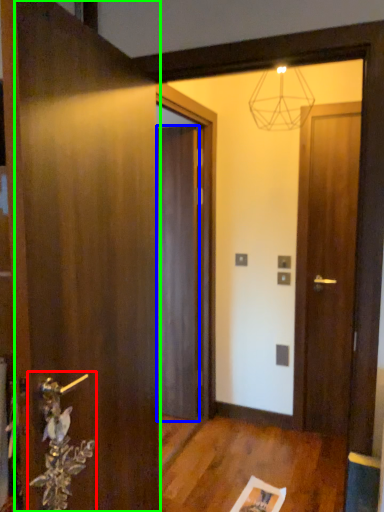
Question: Based on their relative distances, which object is nearer to door handle (highlighted by a red box)? Choose from door (highlighted by a blue box) and door (highlighted by a green box).

Choices:
 (A) door
 (B) door

Answer: (B)